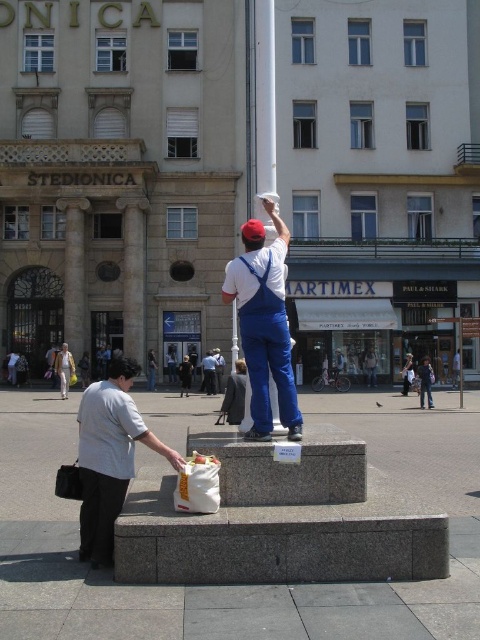
Consider the image. Who is positioned more to the left, white cotton shirt at center or white fabric bag at lower left?

From the viewer's perspective, white fabric bag at lower left appears more on the left side.

Find the location of a particular element. This screenshot has height=640, width=480. white cotton shirt at center is located at coordinates (264, 323).

Identify the location of white cotton shirt at center. (264, 323).

Locate an element on the screen. white fabric bag at lower left is located at coordinates (109, 456).

Can you confirm if white fabric bag at lower left is wider than denim jacket at lower right?

Yes, white fabric bag at lower left is wider than denim jacket at lower right.

Measure the distance between point (x=132, y=422) and camera.

They are 7.03 meters apart.

Find the location of `white fabric bag at lower left`. white fabric bag at lower left is located at coordinates (109, 456).

Can you confirm if white cotton shirt at center is shorter than denim jacket at lower right?

In fact, white cotton shirt at center may be taller than denim jacket at lower right.

Does point (252, 392) come behind point (425, 392)?

No, it is in front of (425, 392).

Image resolution: width=480 pixels, height=640 pixels. Identify the location of white cotton shirt at center. (264, 323).